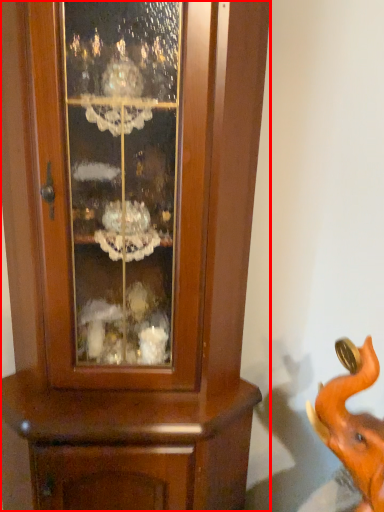
Question: From the image's perspective, where is cupboard (annotated by the red box) located relative to elephant?

Choices:
 (A) above
 (B) below

Answer: (A)